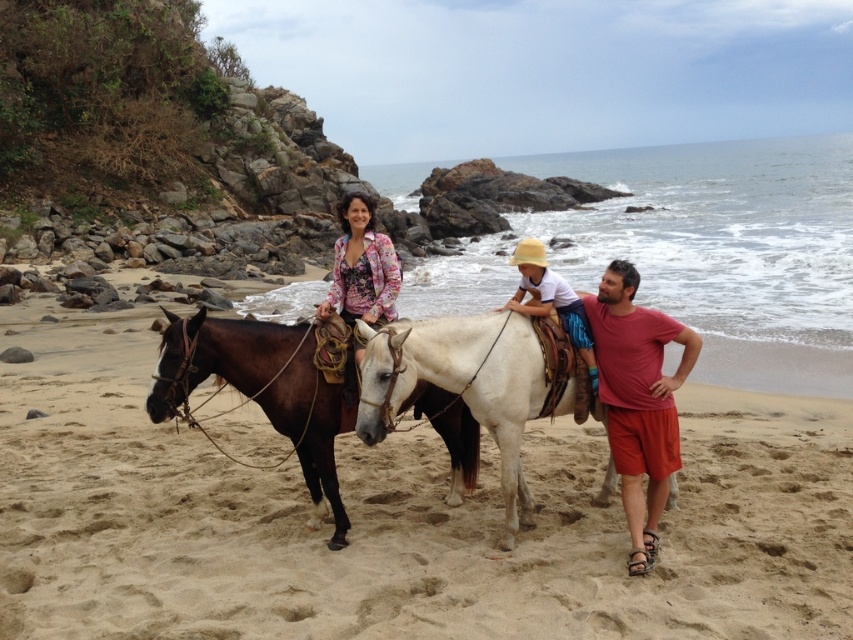
Question: Among these objects, which one is nearest to the camera?

Choices:
 (A) matte red shorts at center
 (B) white cotton shirt at center
 (C) beige sandy beach at center
 (D) shiny brown horse at center

Answer: (C)

Question: Among these points, which one is nearest to the camera?

Choices:
 (A) (415, 356)
 (B) (627, 506)

Answer: (A)

Question: Is the position of brown leather horse at center less distant than that of floral-patterned fabric at center?

Choices:
 (A) no
 (B) yes

Answer: (B)

Question: Can you confirm if beige sandy beach at center is bigger than floral-patterned fabric at center?

Choices:
 (A) no
 (B) yes

Answer: (B)

Question: Is brown leather horse at center positioned behind floral-patterned fabric at center?

Choices:
 (A) no
 (B) yes

Answer: (A)

Question: Which of the following is the farthest from the observer?

Choices:
 (A) floral-patterned fabric at center
 (B) shiny brown horse at center

Answer: (A)